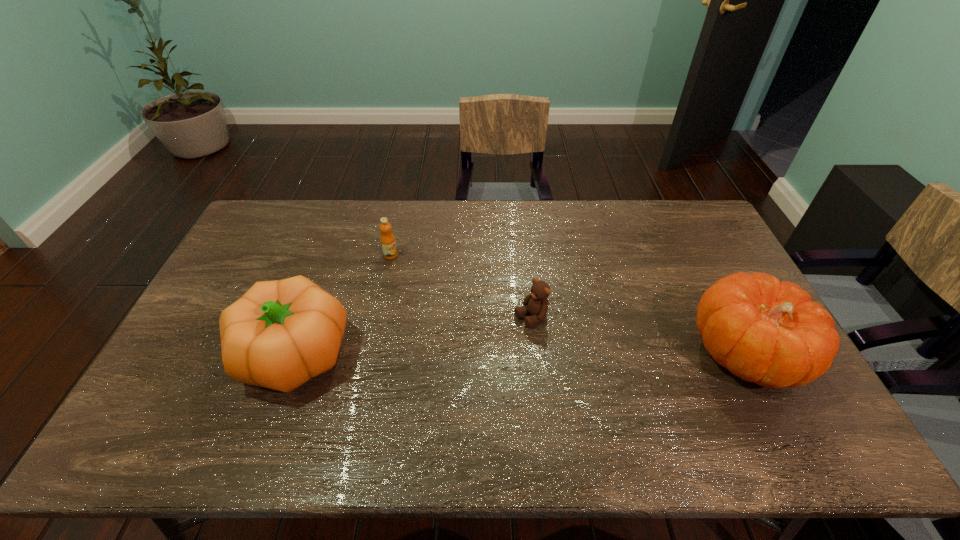
You are a GUI agent. You are given a task and a screenshot of the screen. Output one action in this format:
    pyautogui.click(x=<x>, y=<y>)
    Task: Click on the free spot on the desktop that is between the left pumpkin and the right pumpkin and is positioned on the front label of the second shortest object
    
    Given the screenshot: What is the action you would take?
    pyautogui.click(x=579, y=354)

You are a GUI agent. You are given a task and a screenshot of the screen. Output one action in this format:
    pyautogui.click(x=<x>, y=<y>)
    Task: Click on the free space on the desktop that is between the leftmost object and the rightmost object and is positioned on the face of the second object from right to left
    The height and width of the screenshot is (540, 960).
    Given the screenshot: What is the action you would take?
    pyautogui.click(x=468, y=354)